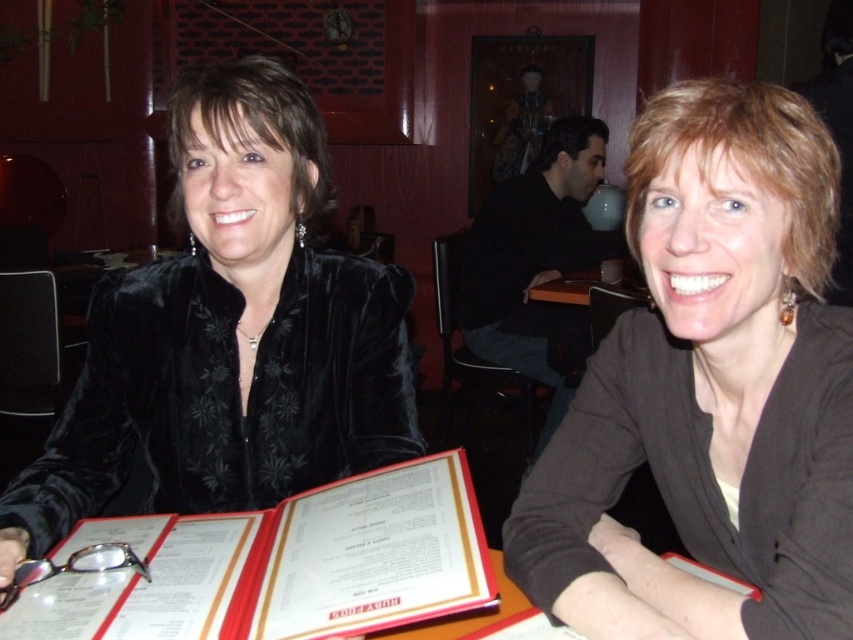
Between velvet black jacket at left and white paper menu at center, which one appears on the left side from the viewer's perspective?

velvet black jacket at left

Looking at this image, is velvet black jacket at left positioned at the back of white paper menu at center?

Yes, it is.

This screenshot has height=640, width=853. What do you see at coordinates (229, 333) in the screenshot?
I see `velvet black jacket at left` at bounding box center [229, 333].

This screenshot has width=853, height=640. Identify the location of velvet black jacket at left. (229, 333).

Who is positioned more to the right, brown matte jacket at center or white paper menu at center?

From the viewer's perspective, brown matte jacket at center appears more on the right side.

You are a GUI agent. You are given a task and a screenshot of the screen. Output one action in this format:
    pyautogui.click(x=<x>, y=<y>)
    Task: Click on the brown matte jacket at center
    This screenshot has width=853, height=640.
    Given the screenshot: What is the action you would take?
    pyautogui.click(x=711, y=388)

Is point (726, 563) positioned in front of point (432, 609)?

That is False.

What are the coordinates of `brown matte jacket at center` in the screenshot? It's located at (711, 388).

Can you confirm if brown matte jacket at center is positioned to the right of velvet black jacket at left?

Indeed, brown matte jacket at center is positioned on the right side of velvet black jacket at left.

Describe the element at coordinates (711, 388) in the screenshot. I see `brown matte jacket at center` at that location.

Where is `brown matte jacket at center`? This screenshot has width=853, height=640. brown matte jacket at center is located at coordinates (711, 388).